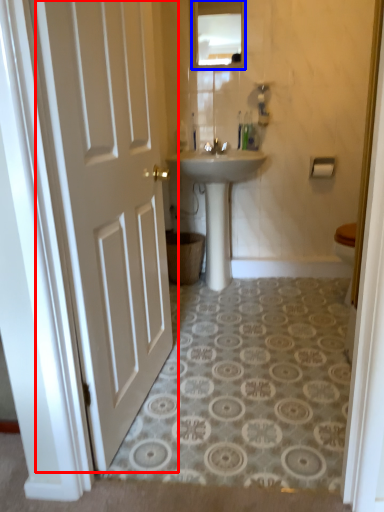
Question: Among these objects, which one is farthest to the camera, door (highlighted by a red box) or mirror (highlighted by a blue box)?

Choices:
 (A) door
 (B) mirror

Answer: (B)